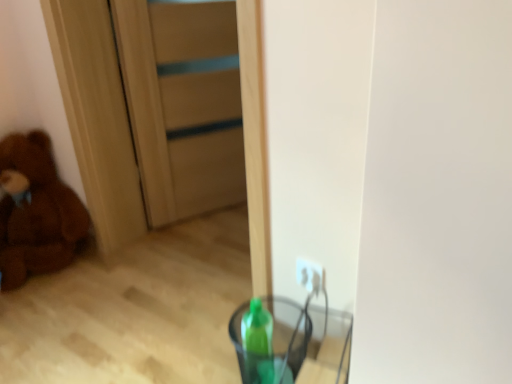
Question: From the image's perspective, is transparent plastic cup at lower center located above wooden door at center?

Choices:
 (A) yes
 (B) no

Answer: (B)

Question: Is there a large distance between transparent plastic cup at lower center and wooden door at center?

Choices:
 (A) no
 (B) yes

Answer: (B)

Question: Can we say transparent plastic cup at lower center lies outside wooden door at center?

Choices:
 (A) yes
 (B) no

Answer: (A)

Question: Is the position of transparent plastic cup at lower center less distant than that of wooden door at center?

Choices:
 (A) no
 (B) yes

Answer: (B)

Question: Is the surface of transparent plastic cup at lower center in direct contact with wooden door at center?

Choices:
 (A) no
 (B) yes

Answer: (A)

Question: Is wooden door at center taller or shorter than brown plush teddy bear at left?

Choices:
 (A) short
 (B) tall

Answer: (B)

Question: In the image, is wooden door at center on the left side or the right side of brown plush teddy bear at left?

Choices:
 (A) left
 (B) right

Answer: (B)

Question: From a real-world perspective, is wooden door at center positioned above or below brown plush teddy bear at left?

Choices:
 (A) above
 (B) below

Answer: (A)

Question: Is point (145, 81) closer or farther from the camera than point (37, 160)?

Choices:
 (A) farther
 (B) closer

Answer: (B)

Question: Is brown plush teddy bear at left inside or outside of transparent plastic cup at lower center?

Choices:
 (A) inside
 (B) outside

Answer: (B)

Question: Looking at the image, does brown plush teddy bear at left seem bigger or smaller compared to transparent plastic cup at lower center?

Choices:
 (A) small
 (B) big

Answer: (B)

Question: In terms of width, does brown plush teddy bear at left look wider or thinner when compared to transparent plastic cup at lower center?

Choices:
 (A) wide
 (B) thin

Answer: (A)

Question: In terms of height, does brown plush teddy bear at left look taller or shorter compared to transparent plastic cup at lower center?

Choices:
 (A) short
 (B) tall

Answer: (B)

Question: Relative to brown plush teddy bear at left, is transparent plastic cup at lower center in front or behind?

Choices:
 (A) behind
 (B) front

Answer: (B)

Question: Looking at their shapes, would you say transparent plastic cup at lower center is wider or thinner than brown plush teddy bear at left?

Choices:
 (A) thin
 (B) wide

Answer: (A)